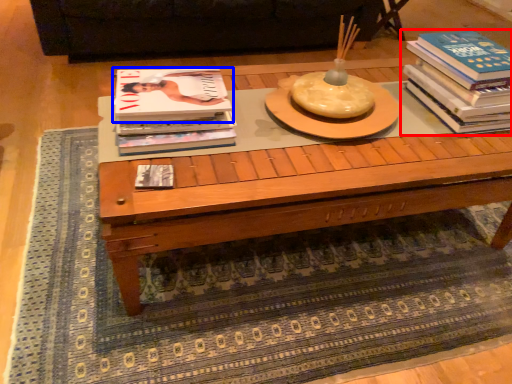
Question: Among these objects, which one is farthest to the camera, book (highlighted by a red box) or book (highlighted by a blue box)?

Choices:
 (A) book
 (B) book

Answer: (A)